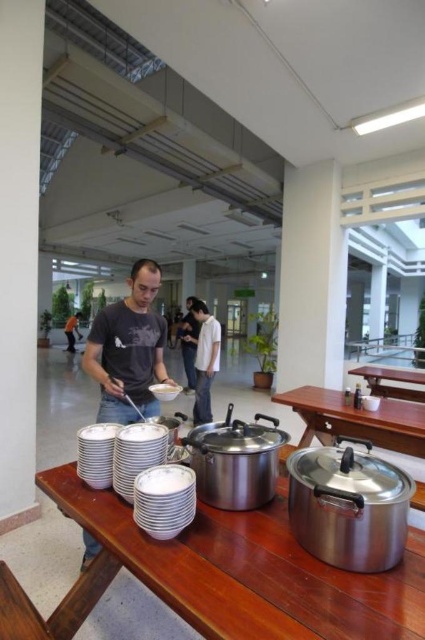
Is matte gray shirt at center above orange fabric shirt at center?

Correct, matte gray shirt at center is located above orange fabric shirt at center.

What are the coordinates of `matte gray shirt at center` in the screenshot? It's located at (129, 349).

Identify the location of matte gray shirt at center. This screenshot has height=640, width=425. (129, 349).

Who is shorter, wooden table at center or white matte bowl at center?

Standing shorter between the two is white matte bowl at center.

Between wooden table at center and white matte bowl at center, which one is positioned lower?

wooden table at center is lower down.

Is point (334, 595) farther from camera compared to point (161, 385)?

No, (334, 595) is in front of (161, 385).

In order to click on wooden table at center in this screenshot , I will do `click(238, 573)`.

Who is more forward, (x=329, y=435) or (x=79, y=312)?

Point (x=329, y=435) is more forward.

Between stainless steel pots at center and orange fabric shirt at center, which one has less height?

stainless steel pots at center is shorter.

The image size is (425, 640). Describe the element at coordinates (357, 419) in the screenshot. I see `stainless steel pots at center` at that location.

I want to click on stainless steel pots at center, so click(357, 419).